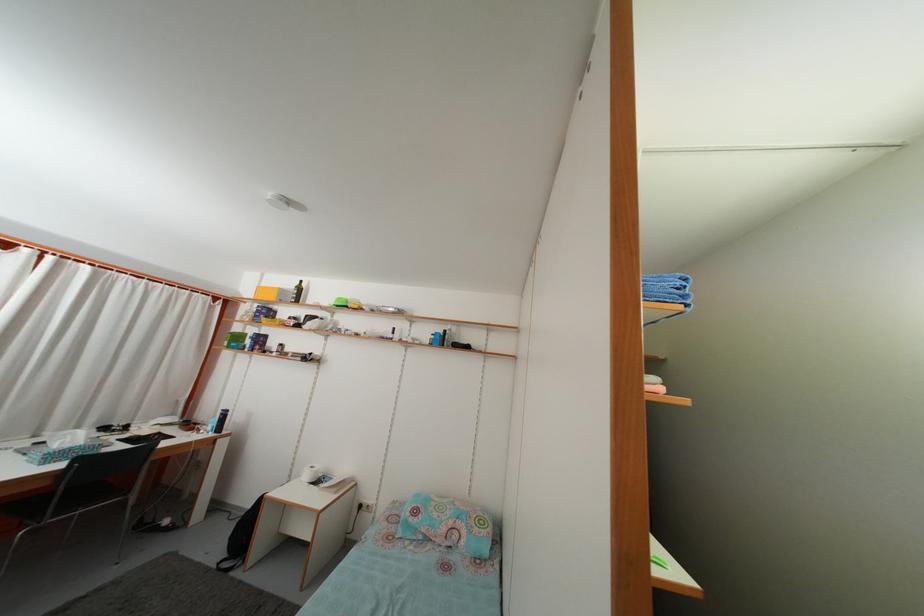
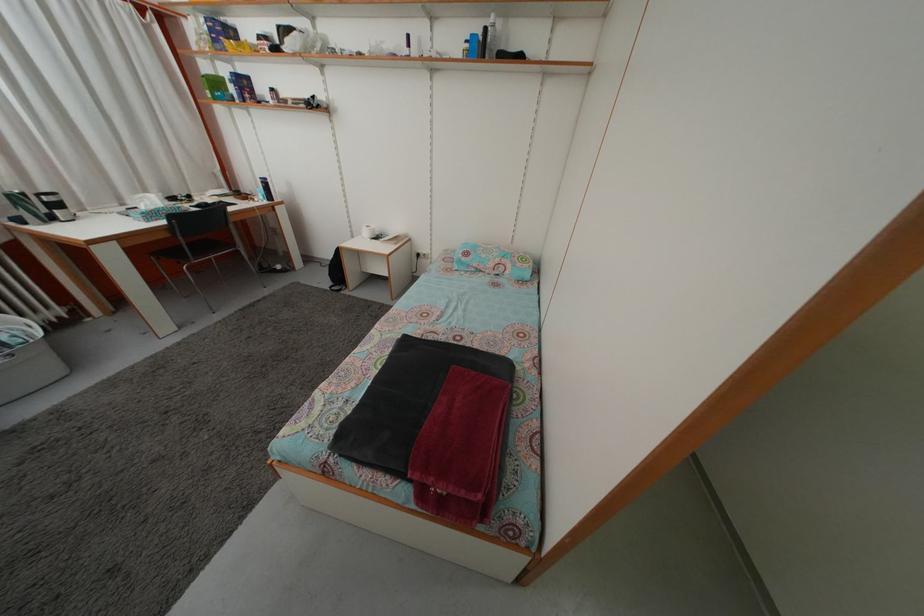
The point at (244, 345) is marked in the first image. Where is the corresponding point in the second image?

(223, 91)